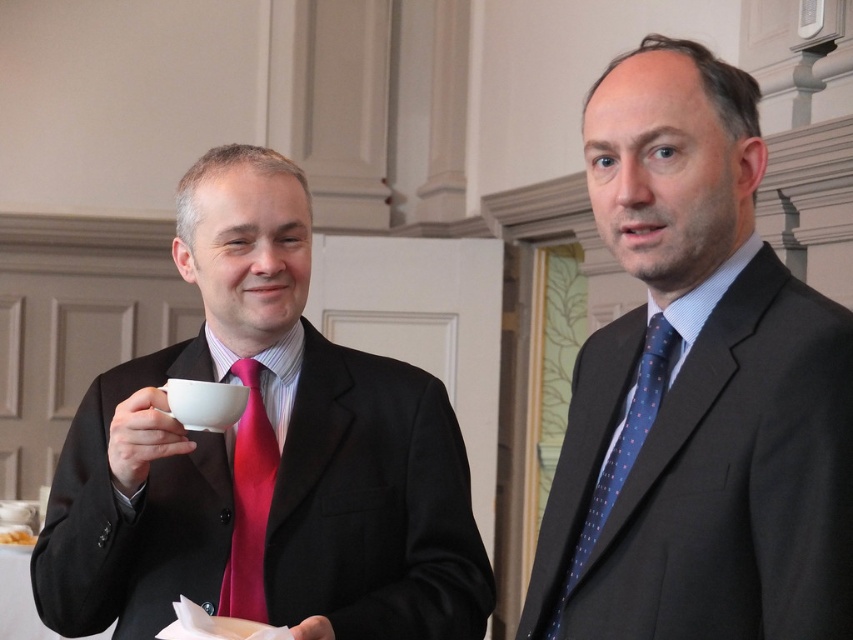
This screenshot has height=640, width=853. What do you see at coordinates (695, 388) in the screenshot?
I see `matte black suit at right` at bounding box center [695, 388].

Does point (605, 621) lie behind point (650, 397)?

No, (605, 621) is closer to viewer.

Is point (805, 410) positioned behind point (677, 342)?

That is False.

The height and width of the screenshot is (640, 853). In order to click on matte black suit at right in this screenshot , I will do `click(695, 388)`.

How far apart are matte black suit at right and matte pink tie at left?

A distance of 30.43 inches exists between matte black suit at right and matte pink tie at left.

Between point (735, 627) and point (244, 365), which one is positioned in front?

Point (735, 627) is more forward.

Describe the element at coordinates (695, 388) in the screenshot. Image resolution: width=853 pixels, height=640 pixels. I see `matte black suit at right` at that location.

Identify the location of matte black suit at right. (695, 388).

Measure the distance from matte black suit at right to matte black suit at left.

63.53 centimeters

Does matte black suit at right lie behind matte black suit at left?

That is False.

What do you see at coordinates (695, 388) in the screenshot?
I see `matte black suit at right` at bounding box center [695, 388].

I want to click on matte black suit at right, so click(x=695, y=388).